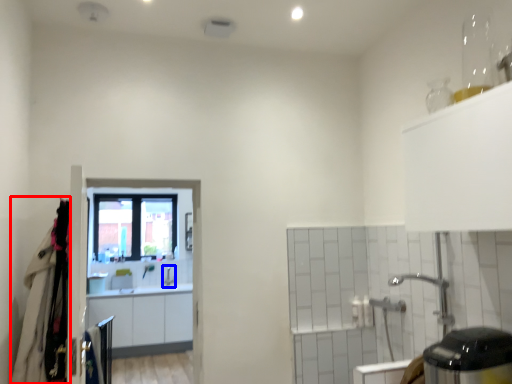
Question: Which object appears closest to the camera in this image, laundry (highlighted by a red box) or faucet (highlighted by a blue box)?

Choices:
 (A) laundry
 (B) faucet

Answer: (A)